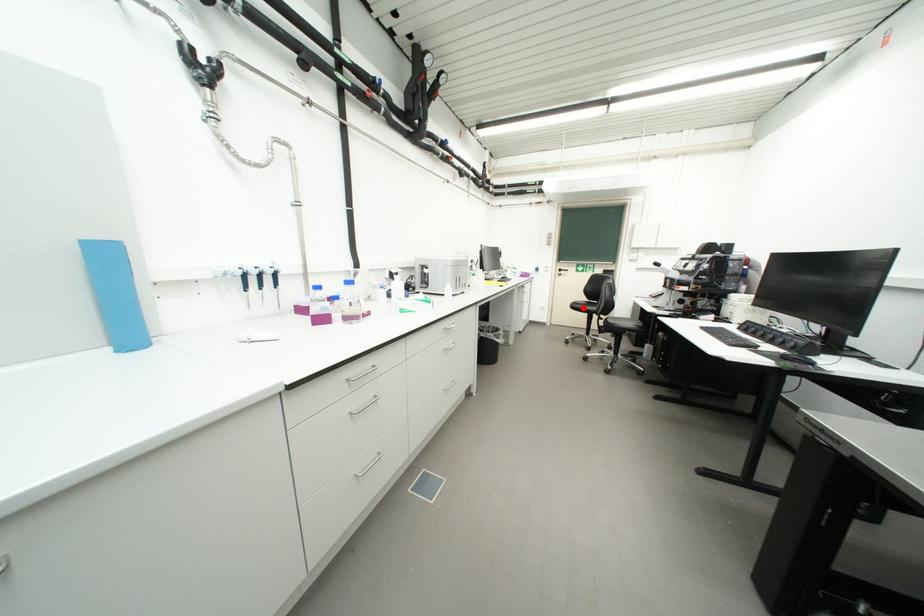
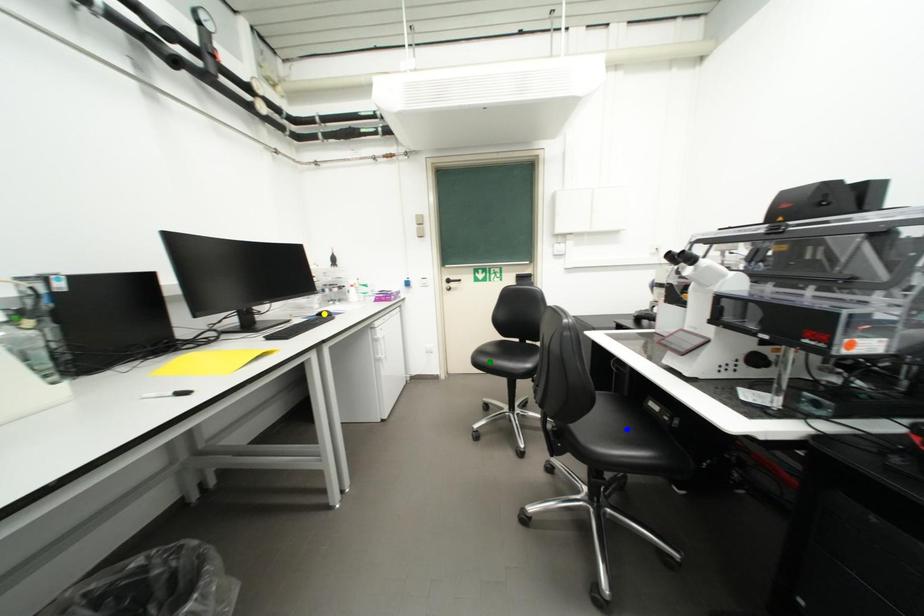
Question: I am providing you with two images of the same scene from different viewpoints. A red point is marked on the first image. You are given multiple points on the second image. Which spot in image 2 lines up with the point in image 1?

Choices:
 (A) blue point
 (B) green point
 (C) yellow point

Answer: (B)